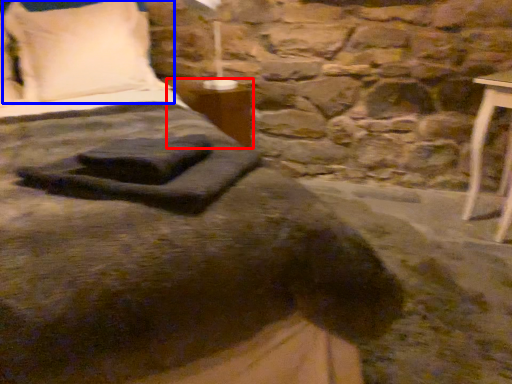
Question: Which of the following is the farthest to the observer, table (highlighted by a red box) or pillow (highlighted by a blue box)?

Choices:
 (A) table
 (B) pillow

Answer: (A)